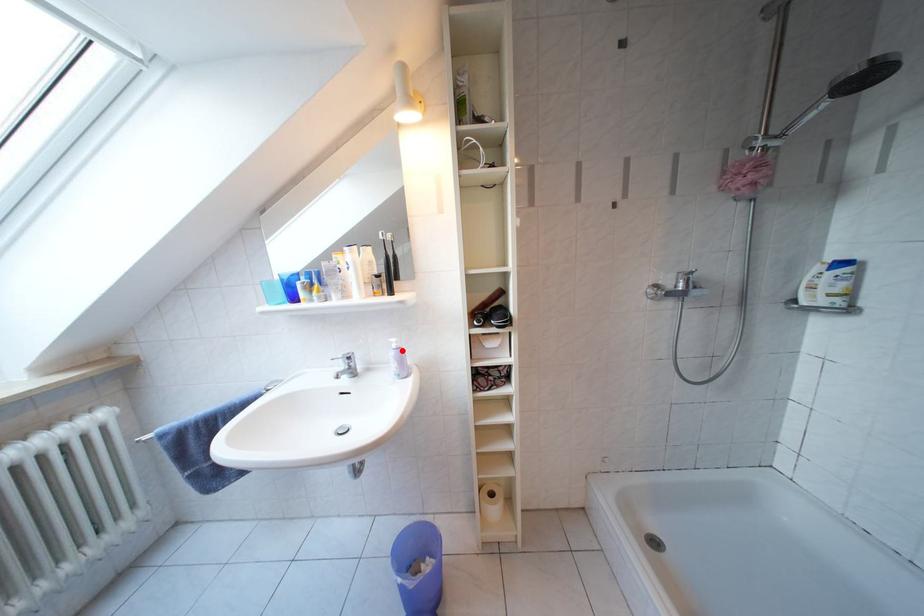
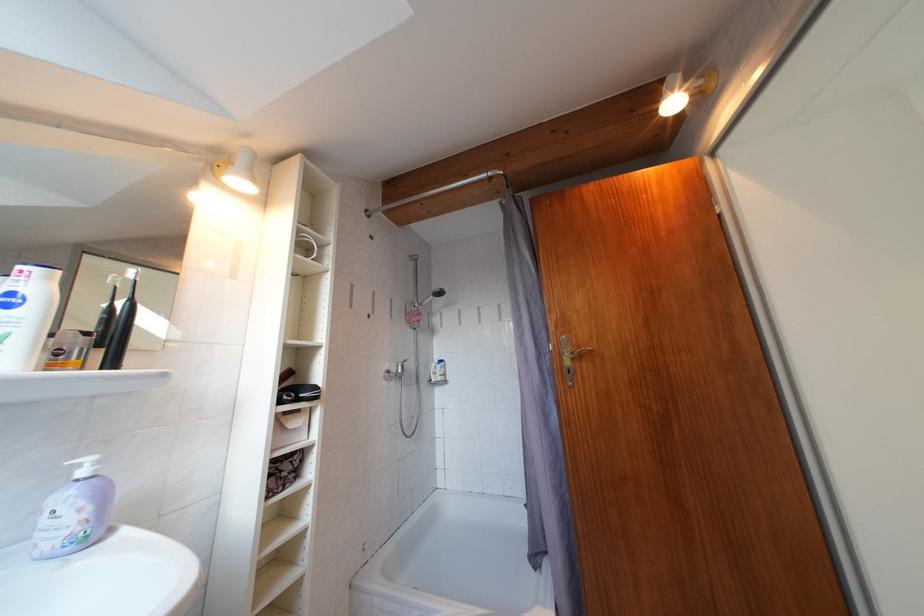
Where in the second image is the point corresponding to the highlighted location from the first image?

(92, 477)